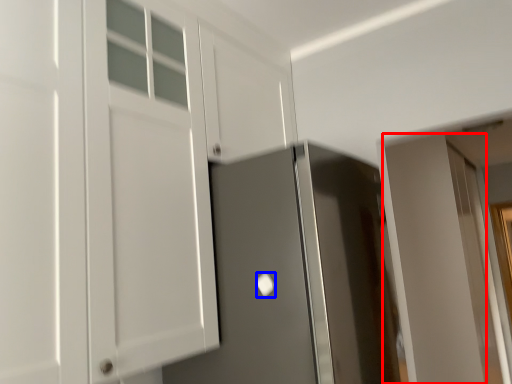
Question: Which object appears farthest to the camera in this image, door (highlighted by a red box) or door handle (highlighted by a blue box)?

Choices:
 (A) door
 (B) door handle

Answer: (A)